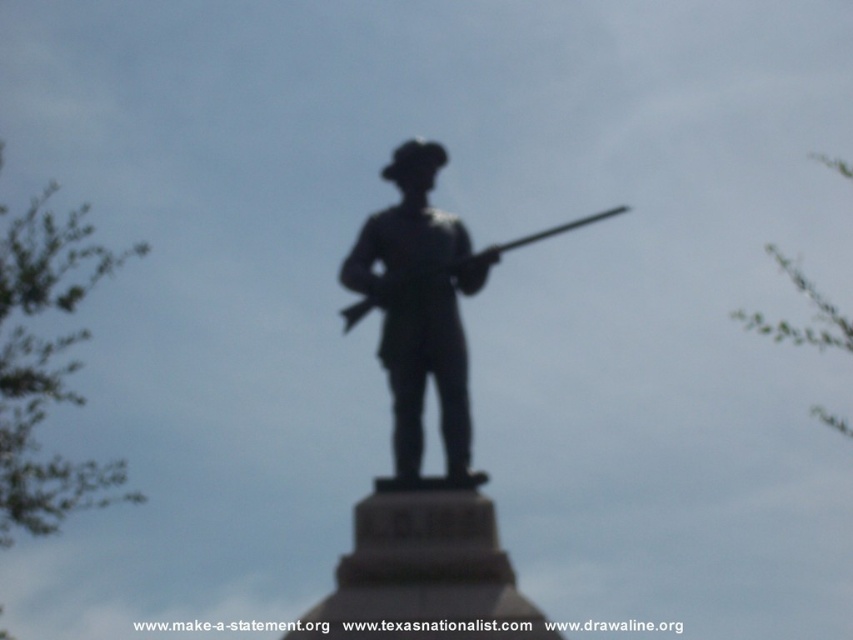
Based on the photo, between black metal statue at center and silhouette wood figure at center, which one has less height?

Standing shorter between the two is silhouette wood figure at center.

Is point (311, 628) farther from camera compared to point (408, 300)?

No, (311, 628) is closer to viewer.

This screenshot has width=853, height=640. I want to click on black metal statue at center, so click(421, 442).

Does silhouette wood figure at center appear on the left side of metallic rifle at center?

Yes, silhouette wood figure at center is to the left of metallic rifle at center.

Is point (412, 252) positioned in front of point (569, 224)?

That is False.

Identify the location of silhouette wood figure at center. coord(419,307).

Does black metal statue at center come behind metallic rifle at center?

No, black metal statue at center is in front of metallic rifle at center.

Is black metal statue at center wider than metallic rifle at center?

Correct, the width of black metal statue at center exceeds that of metallic rifle at center.

Is point (396, 518) behind point (556, 228)?

No.

Locate an element on the screen. This screenshot has height=640, width=853. black metal statue at center is located at coordinates (421, 442).